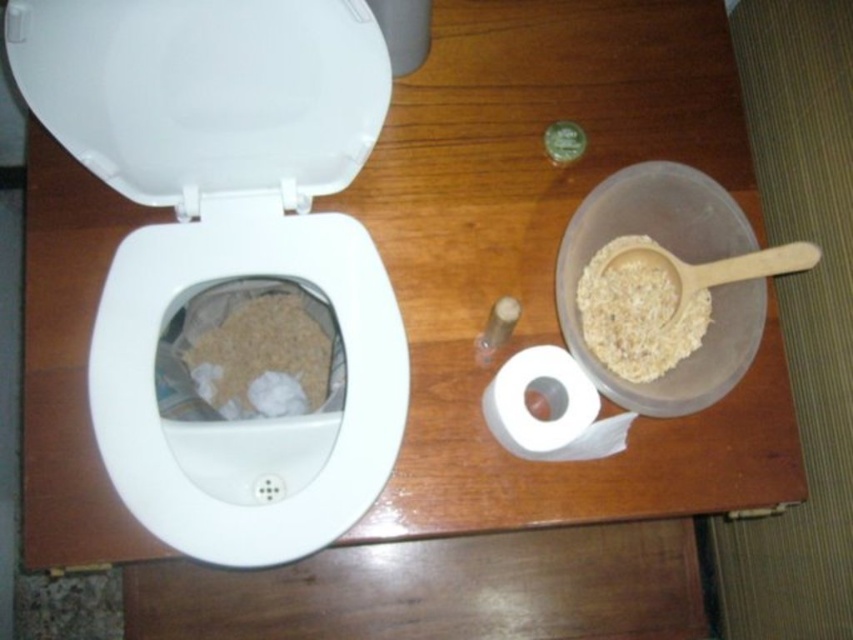
Between brown matte cereal at upper right and white matte toilet paper at lower right, which one is positioned lower?

white matte toilet paper at lower right is lower down.

Between point (602, 252) and point (535, 381), which one is positioned in front?

Positioned in front is point (535, 381).

Locate an element on the screen. The height and width of the screenshot is (640, 853). brown matte cereal at upper right is located at coordinates (637, 310).

At what (x,y) coordinates should I click in order to perform the action: click on brown matte cereal at upper right. Please return your answer as a coordinate pair (x, y). Looking at the image, I should click on (637, 310).

Is white glossy toilet bowl at left thinner than brown matte cereal at upper right?

No.

Can you confirm if white glossy toilet bowl at left is smaller than brown matte cereal at upper right?

No, white glossy toilet bowl at left is not smaller than brown matte cereal at upper right.

Describe the element at coordinates (247, 422) in the screenshot. This screenshot has width=853, height=640. I see `white glossy toilet bowl at left` at that location.

Where is `white glossy toilet bowl at left`? The width and height of the screenshot is (853, 640). white glossy toilet bowl at left is located at coordinates 247,422.

How far apart are translucent plastic bowl at upper right and brown grainy cereal at toilet bowl?

16.74 inches

Which is in front, point (712, 225) or point (281, 388)?

Positioned in front is point (712, 225).

Which is in front, point (670, 179) or point (316, 326)?

Point (670, 179)

Where is `translucent plastic bowl at upper right`? Image resolution: width=853 pixels, height=640 pixels. translucent plastic bowl at upper right is located at coordinates (679, 257).